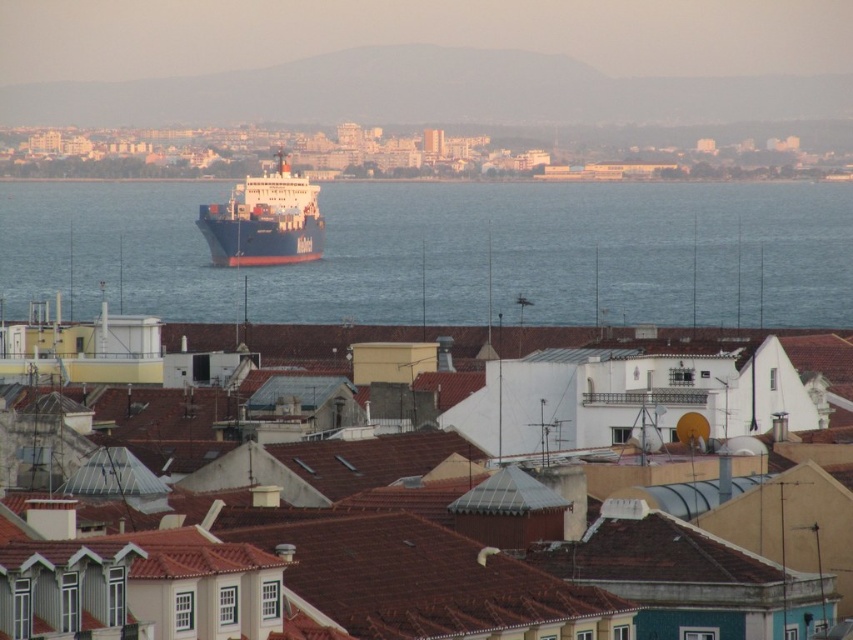
Consider the image. Is blue matte water at center positioned before blue matte cargo ship at center?

Yes, blue matte water at center is in front of blue matte cargo ship at center.

Is point (815, 188) closer to camera compared to point (306, 230)?

No.

At what (x,y) coordinates should I click in order to perform the action: click on blue matte water at center. Please return your answer as a coordinate pair (x, y). The height and width of the screenshot is (640, 853). Looking at the image, I should click on (450, 252).